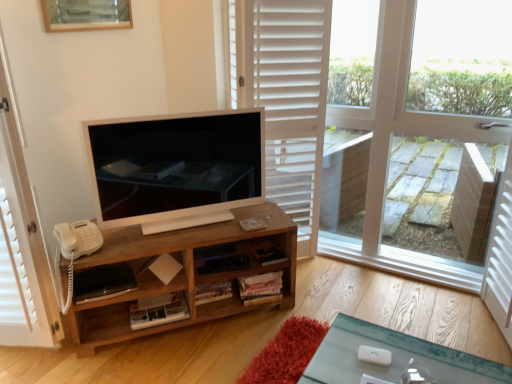
Question: Is wooden picture frame at upper center closer to the viewer compared to satin white television at center?

Choices:
 (A) yes
 (B) no

Answer: (B)

Question: Can you confirm if wooden picture frame at upper center is smaller than satin white television at center?

Choices:
 (A) yes
 (B) no

Answer: (A)

Question: Can you confirm if wooden picture frame at upper center is bigger than satin white television at center?

Choices:
 (A) yes
 (B) no

Answer: (B)

Question: Does wooden picture frame at upper center turn towards satin white television at center?

Choices:
 (A) yes
 (B) no

Answer: (B)

Question: Is wooden picture frame at upper center shorter than satin white television at center?

Choices:
 (A) yes
 (B) no

Answer: (A)

Question: Does point (420, 256) appear closer or farther from the camera than point (244, 145)?

Choices:
 (A) closer
 (B) farther

Answer: (B)

Question: From a real-world perspective, is transparent glass window at center physically located above or below satin white television at center?

Choices:
 (A) above
 (B) below

Answer: (A)

Question: Visually, is transparent glass window at center positioned to the left or to the right of satin white television at center?

Choices:
 (A) right
 (B) left

Answer: (A)

Question: From their relative heights in the image, would you say transparent glass window at center is taller or shorter than satin white television at center?

Choices:
 (A) tall
 (B) short

Answer: (A)

Question: Is wooden picture frame at upper center inside or outside of wooden cabinet at center?

Choices:
 (A) outside
 (B) inside

Answer: (A)

Question: In terms of height, does wooden picture frame at upper center look taller or shorter compared to wooden cabinet at center?

Choices:
 (A) tall
 (B) short

Answer: (B)

Question: From a real-world perspective, is wooden picture frame at upper center above or below wooden cabinet at center?

Choices:
 (A) above
 (B) below

Answer: (A)

Question: Based on their sizes in the image, would you say wooden picture frame at upper center is bigger or smaller than wooden cabinet at center?

Choices:
 (A) small
 (B) big

Answer: (A)

Question: Relative to white wooden screen door at left, marked as the first screen door in a left-to-right arrangement, is white wooden screen door at right, the second screen door viewed from the left, in front or behind?

Choices:
 (A) front
 (B) behind

Answer: (B)

Question: Does point (506, 175) appear closer or farther from the camera than point (6, 144)?

Choices:
 (A) farther
 (B) closer

Answer: (A)